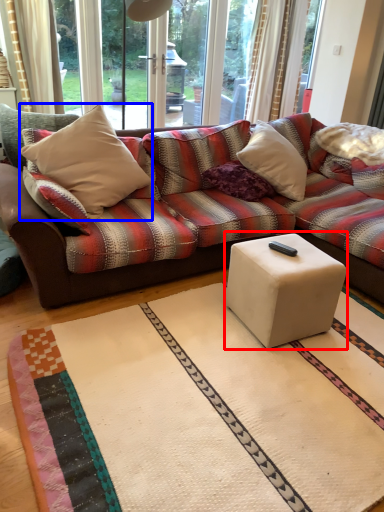
Question: Which object appears closest to the camera in this image, coffee table (highlighted by a red box) or throw pillow (highlighted by a blue box)?

Choices:
 (A) coffee table
 (B) throw pillow

Answer: (A)